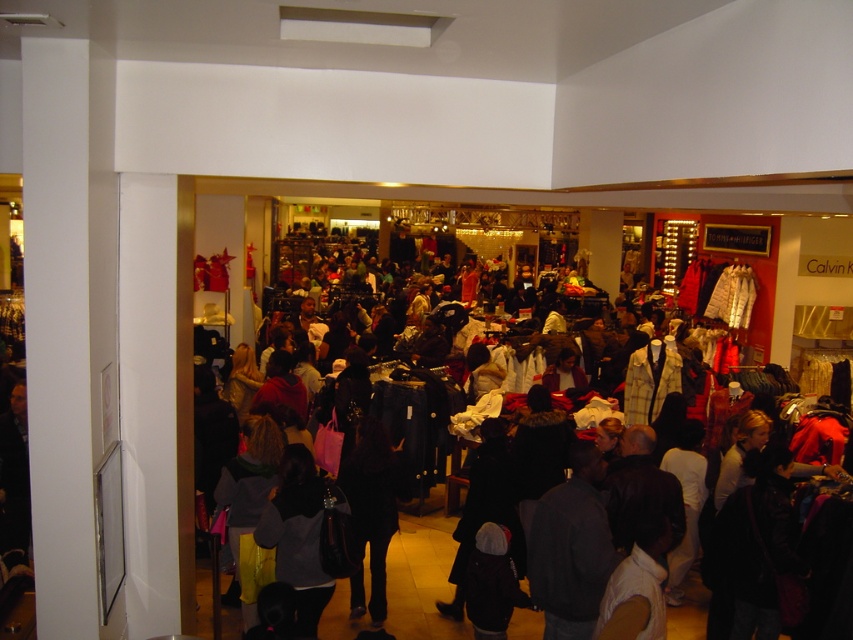
Between point (322, 602) and point (657, 374), which one is positioned behind?

The point (657, 374) is behind.

Is dark gray sweater at lower center thinner than yellow plaid jacket at center?

Correct, dark gray sweater at lower center's width is less than yellow plaid jacket at center's.

Locate an element on the screen. This screenshot has height=640, width=853. dark gray sweater at lower center is located at coordinates (299, 547).

Can you confirm if black fabric pants at center is positioned to the right of light brown fabric shirt at lower right?

Incorrect, black fabric pants at center is not on the right side of light brown fabric shirt at lower right.

Can you confirm if black fabric pants at center is wider than light brown fabric shirt at lower right?

Yes, black fabric pants at center is wider than light brown fabric shirt at lower right.

Is point (386, 456) farther from viewer compared to point (657, 598)?

Yes, point (386, 456) is behind point (657, 598).

Find the location of a particular element. This screenshot has width=853, height=640. black fabric pants at center is located at coordinates (373, 509).

Which is below, white cotton shirt at center or white cotton pants at center?

Positioned lower is white cotton pants at center.

Is point (229, 570) positioned in front of point (689, 449)?

Yes, it is in front of point (689, 449).

Locate an element on the screen. The width and height of the screenshot is (853, 640). white cotton shirt at center is located at coordinates (421, 497).

Where is `white cotton shirt at center`? This screenshot has width=853, height=640. white cotton shirt at center is located at coordinates (421, 497).